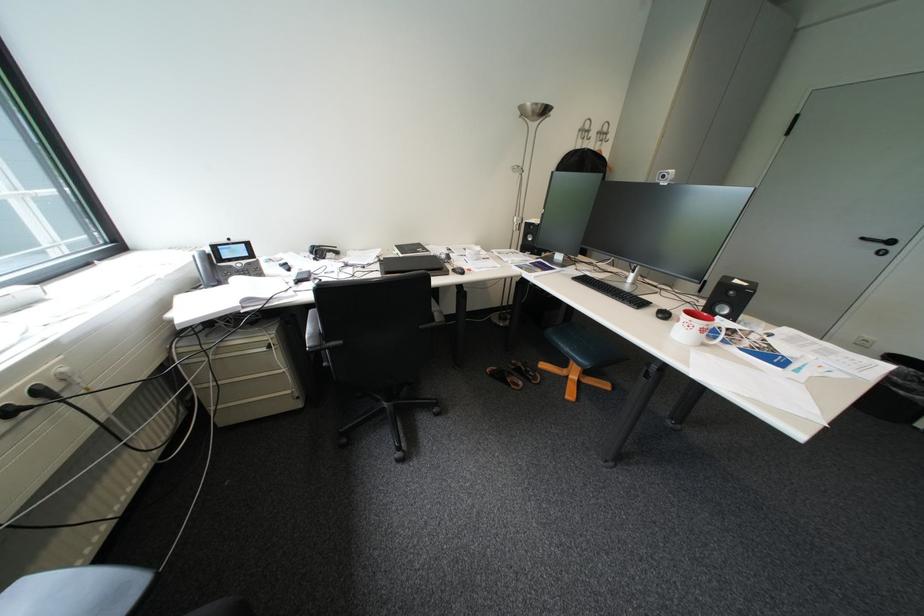
Identify the location of gray telephone handset. (204, 268).